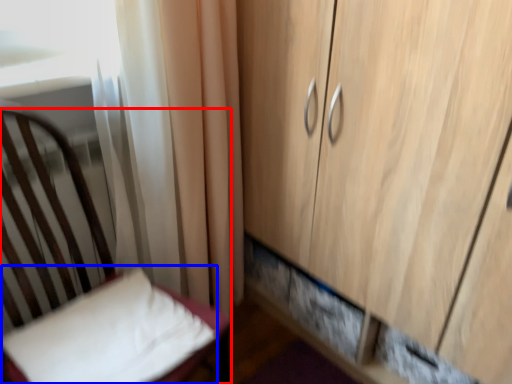
Question: Which object is closer to the camera taking this photo, furniture (highlighted by a red box) or pillow (highlighted by a blue box)?

Choices:
 (A) furniture
 (B) pillow

Answer: (A)